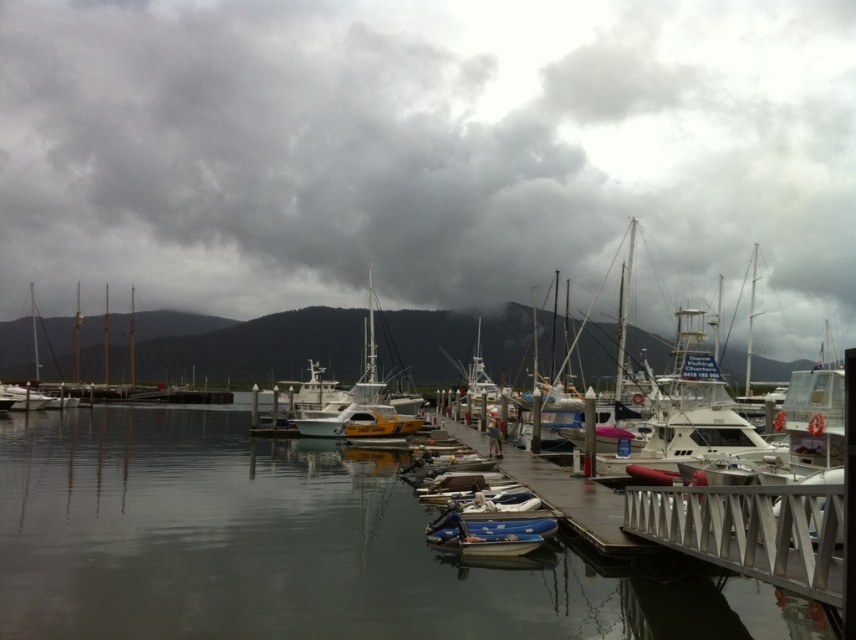
You are standing at the edge of the marina and notice a point marked at coordinates (708, 524). What object is located at this point?

The point at coordinates (708, 524) corresponds to the metallic dock at center.